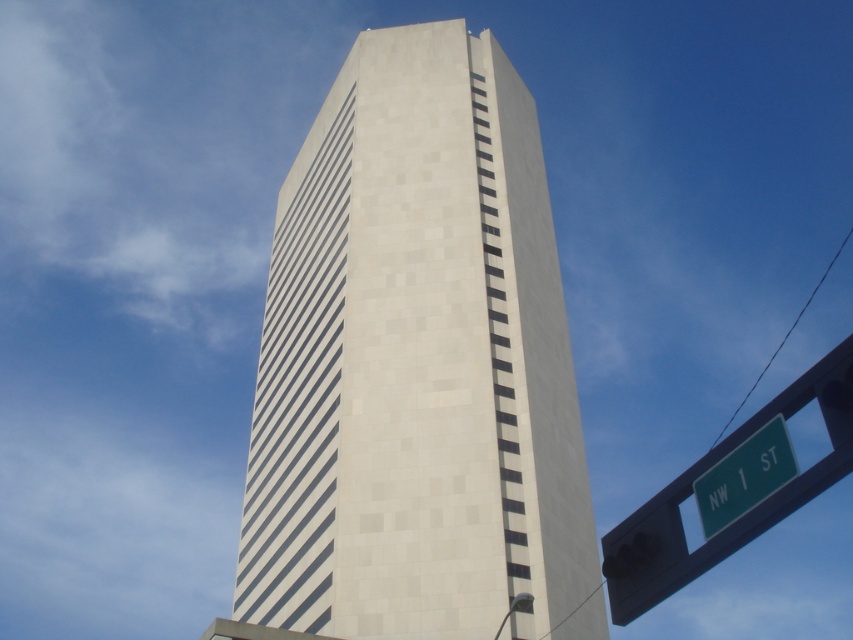
Between green plastic street sign at lower right and green metallic street sign at upper right, which one appears on the right side from the viewer's perspective?

From the viewer's perspective, green plastic street sign at lower right appears more on the right side.

The height and width of the screenshot is (640, 853). Describe the element at coordinates (740, 516) in the screenshot. I see `green plastic street sign at lower right` at that location.

Find the location of a particular element. This screenshot has height=640, width=853. green plastic street sign at lower right is located at coordinates (740, 516).

Is white textured building at center behind green metallic street sign at upper right?

That is True.

Between white textured building at center and green metallic street sign at upper right, which one appears on the left side from the viewer's perspective?

white textured building at center

Is point (395, 28) less distant than point (734, 518)?

No.

Image resolution: width=853 pixels, height=640 pixels. I want to click on white textured building at center, so click(x=415, y=362).

Does white textured building at center have a lesser height compared to green plastic street sign at lower right?

Correct, white textured building at center is not as tall as green plastic street sign at lower right.

Which is in front, point (323, 230) or point (657, 580)?

Point (657, 580) is in front.

Where is `white textured building at center`? This screenshot has width=853, height=640. white textured building at center is located at coordinates (415, 362).